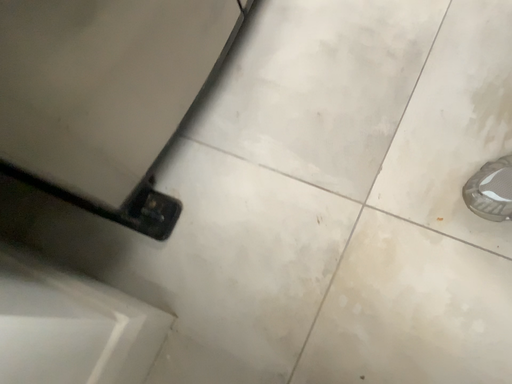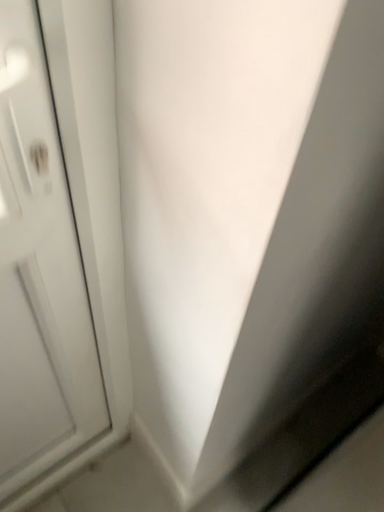
Question: Which way did the camera rotate in the video?

Choices:
 (A) rotated right
 (B) rotated left

Answer: (B)